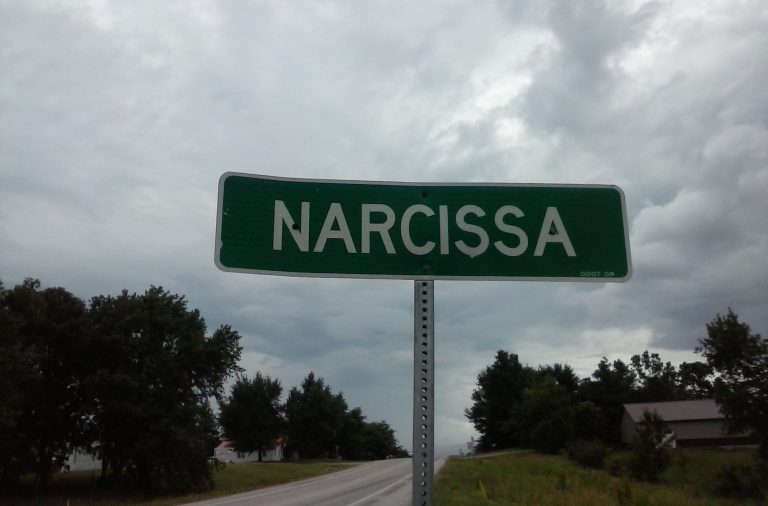
The height and width of the screenshot is (506, 768). I want to click on white stairs, so click(667, 437).